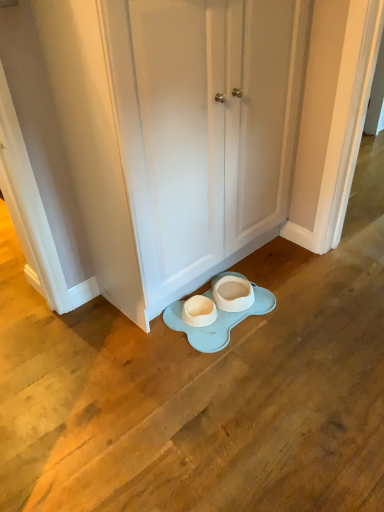
Find the location of a particular element. Image resolution: width=384 pixels, height=512 pixels. spots to the right of white matte door at center is located at coordinates (296, 285).